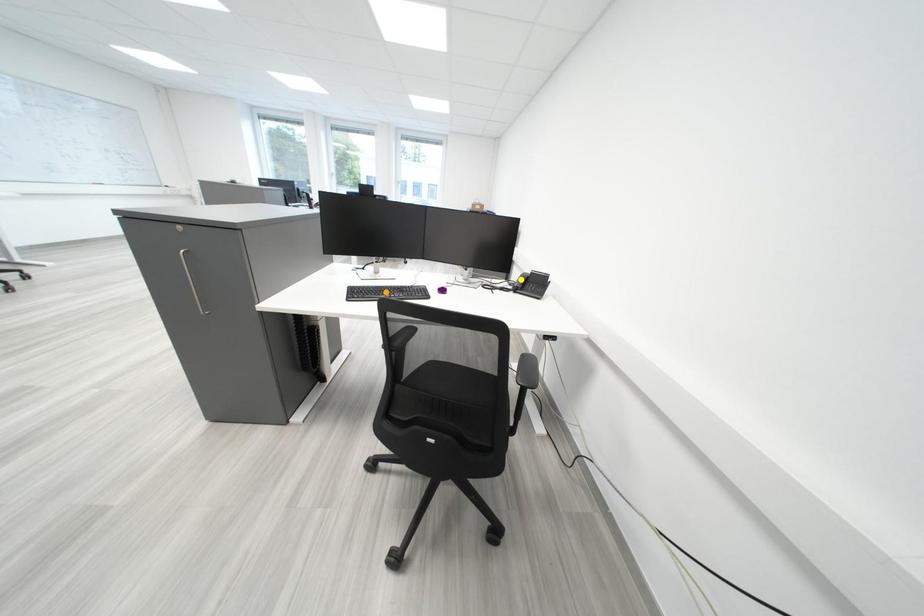
Order these from farthest to nearest:
orange point | purple point | yellow point

yellow point → purple point → orange point